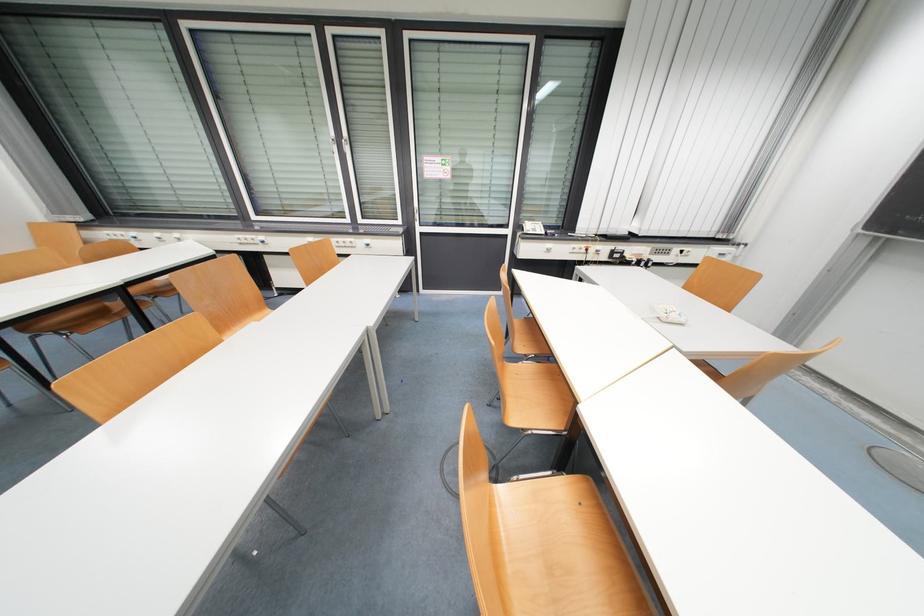
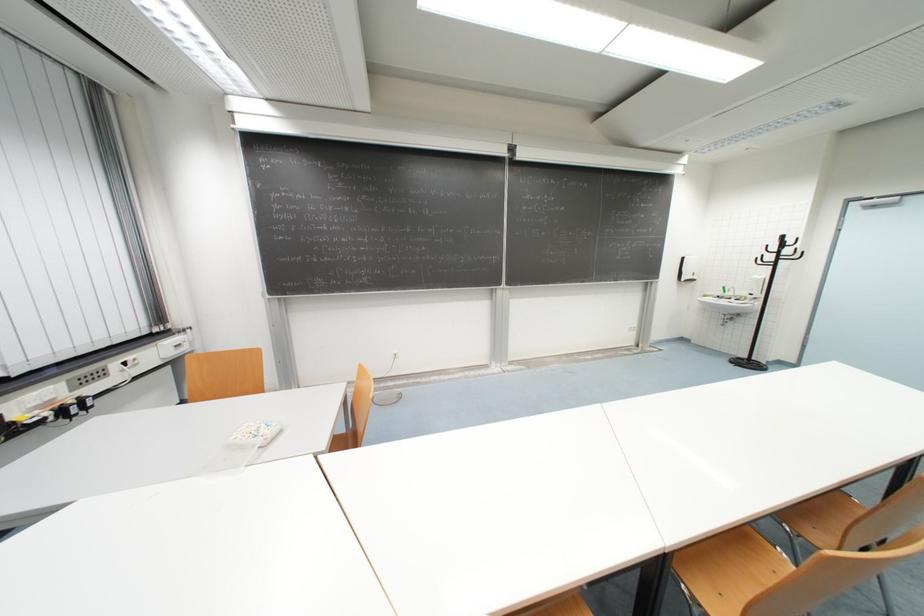
Find the pixel in the second image that matches [653,262] in the first image.

(88, 400)